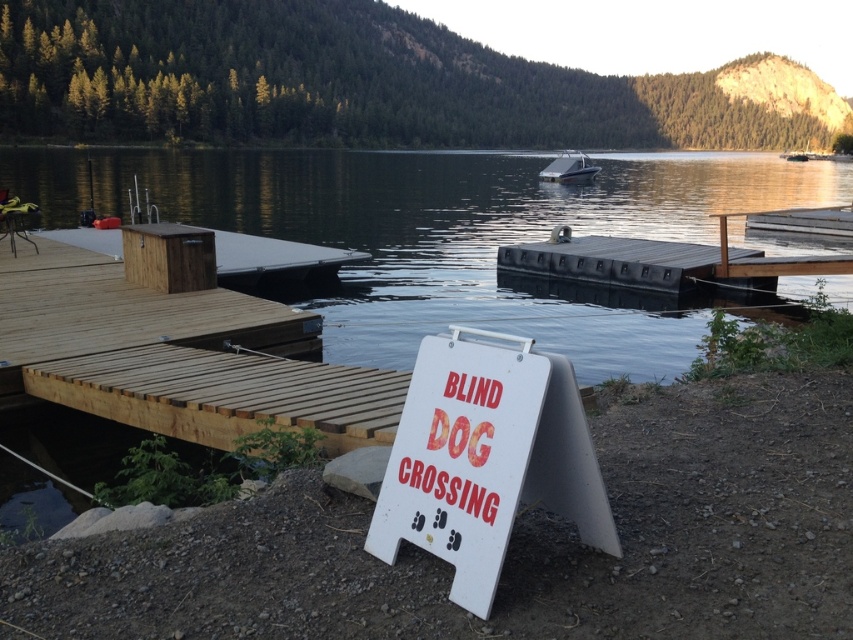
Question: Estimate the real-world distances between objects in this image. Which object is closer to the transparent water at center?

Choices:
 (A) white glossy boat at center
 (B) white paper sign at center

Answer: (B)

Question: Is white paper sign at center below white glossy boat at center?

Choices:
 (A) yes
 (B) no

Answer: (A)

Question: Which of the following is the farthest from the observer?

Choices:
 (A) (550, 172)
 (B) (49, 154)

Answer: (B)

Question: Estimate the real-world distances between objects in this image. Which object is farther from the white glossy boat at center?

Choices:
 (A) white paper sign at center
 (B) transparent water at center

Answer: (A)

Question: Can you confirm if white paper sign at center is positioned to the left of white glossy boat at center?

Choices:
 (A) yes
 (B) no

Answer: (A)

Question: Is transparent water at center to the right of white glossy boat at center from the viewer's perspective?

Choices:
 (A) no
 (B) yes

Answer: (A)